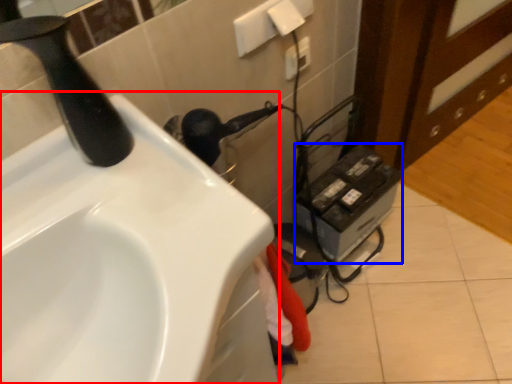
Question: Which of the following is the farthest to the observer, sink (highlighted by a red box) or appliance (highlighted by a blue box)?

Choices:
 (A) sink
 (B) appliance

Answer: (B)